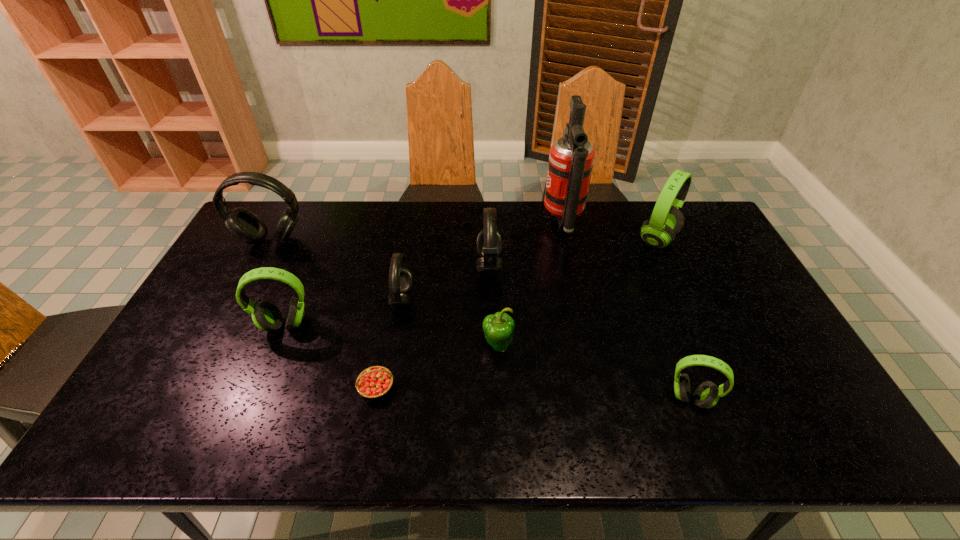
Image resolution: width=960 pixels, height=540 pixels. What are the coordinates of `headset that is the closest to the second nearest green headset` in the screenshot? It's located at (400, 277).

This screenshot has width=960, height=540. Identify the location of the second closest headset to the leftmost gray headset. (400, 277).

Locate which green headset ranks third in proximity to the smallest gray headset. Please provide its 2D coordinates. Your answer should be formatted as a tuple, i.e. [(x, y)], where the tuple contains the x and y coordinates of a point satisfying the conditions above.

[(666, 221)]

What are the coordinates of `the closest green headset to the shortest object` in the screenshot? It's located at (266, 316).

Find the location of a particular element. Image resolution: width=960 pixels, height=540 pixels. gray headset that is the second nearest to the fourth headset from right to left is located at coordinates click(x=243, y=224).

Select which gray headset is the third closest to the shortest object. Please provide its 2D coordinates. Your answer should be formatted as a tuple, i.e. [(x, y)], where the tuple contains the x and y coordinates of a point satisfying the conditions above.

[(243, 224)]

Locate an element on the screen. Image resolution: width=960 pixels, height=540 pixels. vacant space that satisfies the following two spatial constraints: 1. on the front label side of the fire extinguisher; 2. on the right side of the smallest green headset is located at coordinates (603, 399).

Where is `vacant position in the image that satisfies the following two spatial constraints: 1. on the earcups of the smallest green headset; 2. on the right side of the leftmost gray headset`? The height and width of the screenshot is (540, 960). vacant position in the image that satisfies the following two spatial constraints: 1. on the earcups of the smallest green headset; 2. on the right side of the leftmost gray headset is located at coordinates (187, 399).

What are the coordinates of `blank area in the image that satisfies the following two spatial constraints: 1. on the earcups of the smallest gray headset; 2. on the front side of the leftmost green headset` in the screenshot? It's located at pos(398,325).

Locate an element on the screen. free space that satisfies the following two spatial constraints: 1. on the earcups of the third headset from left to right; 2. on the left side of the bell pepper is located at coordinates (395, 345).